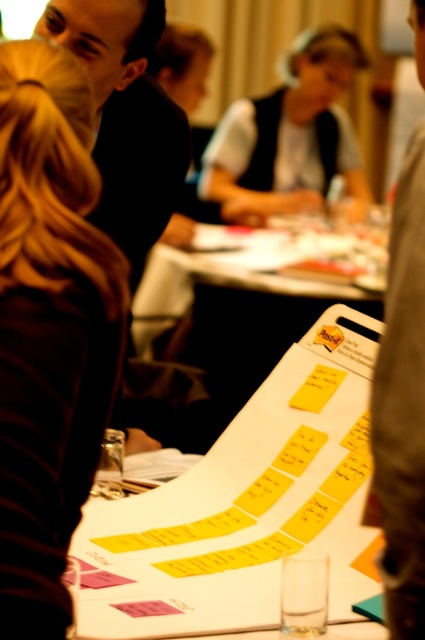
Question: Is dark brown hair at left to the right of yellow paper at center from the viewer's perspective?

Choices:
 (A) no
 (B) yes

Answer: (A)

Question: Can you confirm if dark brown hair at left is bigger than yellow paper at center?

Choices:
 (A) yes
 (B) no

Answer: (B)

Question: Which point is farther to the camera?

Choices:
 (A) (5, 269)
 (B) (227, 116)
 (C) (320, 257)
 (D) (424, 285)

Answer: (B)

Question: Which point is farther to the camera?

Choices:
 (A) (186, 321)
 (B) (308, 58)
 (C) (413, 161)
 (D) (78, 305)

Answer: (B)

Question: Is dark brown hair at left wider than white matte vest at center?

Choices:
 (A) yes
 (B) no

Answer: (B)

Question: Which of the following is the farthest from the observer?

Choices:
 (A) dark brown hair at left
 (B) dark gray fabric jacket at center

Answer: (A)